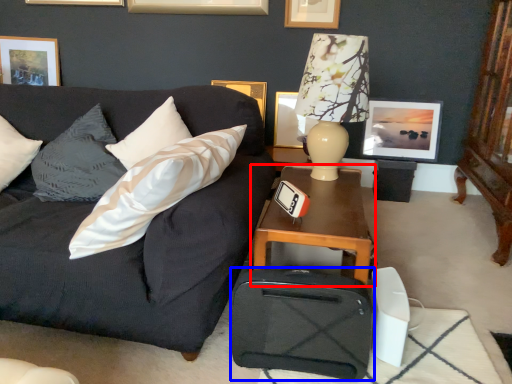
Question: Which point is further to the camera, table (highlighted by a red box) or luggage (highlighted by a blue box)?

Choices:
 (A) table
 (B) luggage

Answer: (A)